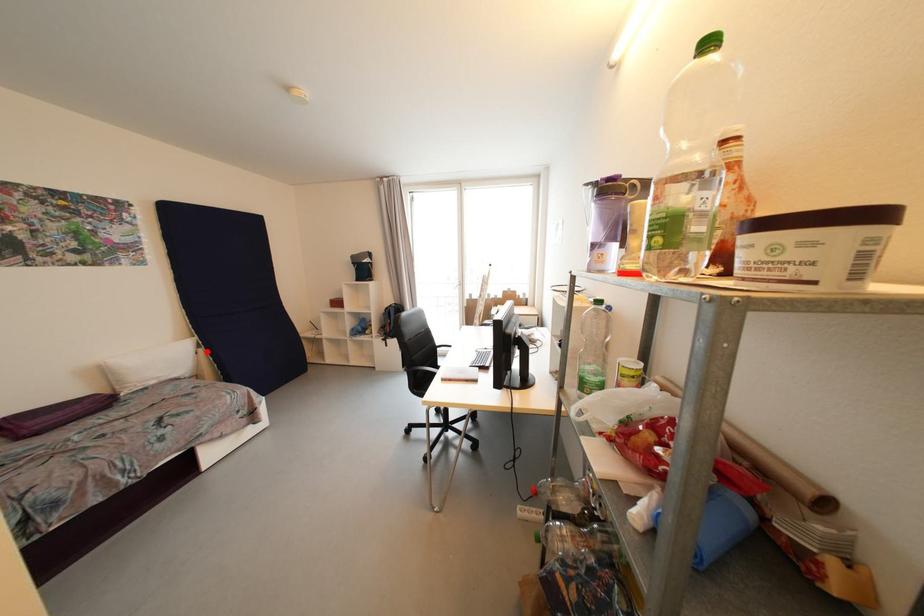
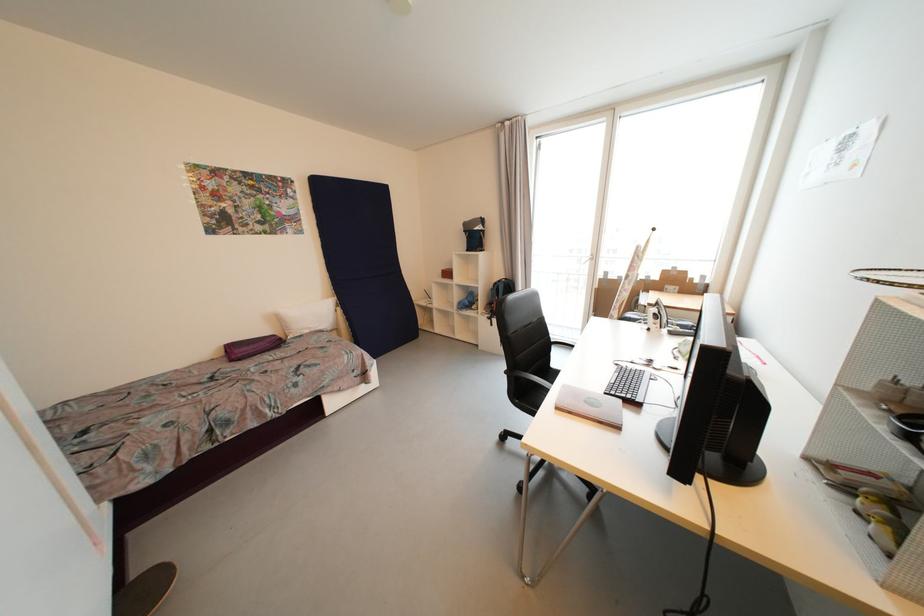
Question: A red point is marked in image1. In image2, is the corresponding 3D point closer to the camera or farther? Reply with the corresponding letter.

Choices:
 (A) The corresponding 3D point is closer.
 (B) The corresponding 3D point is farther.

Answer: (B)